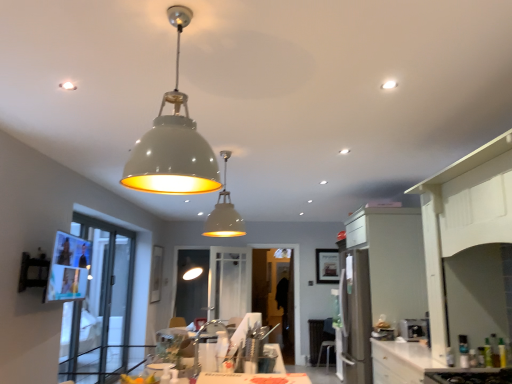
Image resolution: width=512 pixels, height=384 pixels. What do you see at coordinates (408, 363) in the screenshot?
I see `white glossy countertop at lower right` at bounding box center [408, 363].

Measure the distance between white glossy countertop at lower right and camera.

white glossy countertop at lower right is 2.74 meters from camera.

Locate an element on the screen. transparent glass door at center, the 1th glass door viewed from the right is located at coordinates (275, 286).

This screenshot has width=512, height=384. What do you see at coordinates (224, 212) in the screenshot?
I see `matte white pendant light at center, which appears as the second lamp when viewed from the front` at bounding box center [224, 212].

The height and width of the screenshot is (384, 512). Identify the location of matte white dome at center, the second lamp when ordered from back to front. (173, 143).

This screenshot has height=384, width=512. Describe the element at coordinates (414, 329) in the screenshot. I see `satin silver toaster at lower right, positioned as the first appliance in right-to-left order` at that location.

Image resolution: width=512 pixels, height=384 pixels. Describe the element at coordinates (327, 343) in the screenshot. I see `matte white chair at lower center` at that location.

You are a GUI agent. You are given a task and a screenshot of the screen. Output one action in this format:
    pyautogui.click(x=<x>, y=<y>)
    Task: Click on the white glossy countertop at lower right
    The width and height of the screenshot is (512, 384).
    Given the screenshot: What is the action you would take?
    pyautogui.click(x=408, y=363)

Does point (373, 229) lie in front of point (469, 334)?

That is False.

Is satin white cabinet at right directly adjacent to white glossy cabinet at right?

No, satin white cabinet at right is not with white glossy cabinet at right.

Who is taller, satin white cabinet at right or white glossy cabinet at right?

With more height is satin white cabinet at right.

Between satin white cabinet at right and white glossy cabinet at right, which one appears on the left side from the viewer's perspective?

Positioned to the left is satin white cabinet at right.

Is matte white pendant light at center, which ranks as the 1th lamp in back-to-front order, to the left of satin silver toaster at lower right, the 2th appliance when ordered from right to left, from the viewer's perspective?

Yes, matte white pendant light at center, which ranks as the 1th lamp in back-to-front order, is to the left of satin silver toaster at lower right, the 2th appliance when ordered from right to left.

Considering the sizes of objects matte white pendant light at center, which appears as the second lamp when viewed from the front, and satin silver toaster at lower right, placed as the 1th appliance when sorted from left to right, in the image provided, who is shorter, matte white pendant light at center, which appears as the second lamp when viewed from the front, or satin silver toaster at lower right, placed as the 1th appliance when sorted from left to right,?

satin silver toaster at lower right, placed as the 1th appliance when sorted from left to right, is shorter.

From the image's perspective, relative to satin silver toaster at lower right, the 2th appliance when ordered from right to left, is matte white pendant light at center, which ranks as the 1th lamp in back-to-front order, above or below?

Clearly, from the image's perspective, matte white pendant light at center, which ranks as the 1th lamp in back-to-front order, is above satin silver toaster at lower right, the 2th appliance when ordered from right to left.

Measure the distance from matte white pendant light at center, which appears as the second lamp when viewed from the front, to satin silver toaster at lower right, placed as the 1th appliance when sorted from left to right.

1.78 meters.

Is matte white dome at center, which is the 1th lamp from front to back, to the right of satin white cabinet at right from the viewer's perspective?

No, matte white dome at center, which is the 1th lamp from front to back, is not to the right of satin white cabinet at right.

Is matte white dome at center, the second lamp when ordered from back to front, bigger or smaller than satin white cabinet at right?

matte white dome at center, the second lamp when ordered from back to front, is smaller than satin white cabinet at right.

From a real-world perspective, starting from the satin white cabinet at right, which lamp is the 2nd one vertically above it? Please provide its 2D coordinates.

[(173, 143)]

Measure the distance between matte white dome at center, which is the 1th lamp from front to back, and satin white cabinet at right.

matte white dome at center, which is the 1th lamp from front to back, and satin white cabinet at right are 3.10 meters apart.

Can you tell me how much transparent glass door at left, which is the second glass door from back to front, and satin silver toaster at lower right, the 2th appliance when ordered from right to left, differ in facing direction?

There is a 180-degree angle between the facing directions of transparent glass door at left, which is the second glass door from back to front, and satin silver toaster at lower right, the 2th appliance when ordered from right to left.

From a real-world perspective, who is located higher, transparent glass door at left, which is the second glass door from back to front, or satin silver toaster at lower right, the 2th appliance when ordered from right to left?

From a 3D spatial view, transparent glass door at left, which is the second glass door from back to front, is above.

From the image's perspective, is transparent glass door at left, which is counted as the 1th glass door, starting from the front, over satin silver toaster at lower right, the 2th appliance when ordered from right to left?

Incorrect, from the image's perspective, transparent glass door at left, which is counted as the 1th glass door, starting from the front, is lower than satin silver toaster at lower right, the 2th appliance when ordered from right to left.

Is the position of transparent glass door at left, which appears as the 1th glass door when viewed from the left, less distant than that of satin silver toaster at lower right, placed as the 1th appliance when sorted from left to right?

Yes, transparent glass door at left, which appears as the 1th glass door when viewed from the left, is in front of satin silver toaster at lower right, placed as the 1th appliance when sorted from left to right.

Looking at this image, which of these two, transparent glass door at left, which appears as the 1th glass door when viewed from the left, or matte white dome at center, which is the 1th lamp from front to back, is bigger?

With larger size is transparent glass door at left, which appears as the 1th glass door when viewed from the left.

Considering the relative positions of transparent glass door at left, which is counted as the 1th glass door, starting from the front, and matte white dome at center, which is the 1th lamp from front to back, in the image provided, is transparent glass door at left, which is counted as the 1th glass door, starting from the front, to the left or to the right of matte white dome at center, which is the 1th lamp from front to back,?

In the image, transparent glass door at left, which is counted as the 1th glass door, starting from the front, appears on the left side of matte white dome at center, which is the 1th lamp from front to back.

Is transparent glass door at left, which is the second glass door from back to front, facing towards matte white dome at center, which is the 1th lamp from front to back?

No, transparent glass door at left, which is the second glass door from back to front, is not facing towards matte white dome at center, which is the 1th lamp from front to back.

What's the angular difference between transparent glass door at left, which is the second glass door from back to front, and matte white dome at center, the second lamp when ordered from back to front,'s facing directions?

93 degrees.

From the image's perspective, is white glossy cabinet at right located above transparent glass door at left, which appears as the 1th glass door when viewed from the left?

Yes.

Does white glossy cabinet at right have a greater height compared to transparent glass door at left, which is the second glass door from back to front?

No.

Considering the relative positions of white glossy cabinet at right and transparent glass door at left, arranged as the 2th glass door when viewed from the right, in the image provided, is white glossy cabinet at right behind transparent glass door at left, arranged as the 2th glass door when viewed from the right,?

That is False.

Can you tell me how much white glossy cabinet at right and transparent glass door at left, which is the second glass door from back to front, differ in facing direction?

180 degrees.

Considering the relative sizes of satin white cabinet at right and satin silver toaster at lower right, positioned as the first appliance in right-to-left order, in the image provided, is satin white cabinet at right smaller than satin silver toaster at lower right, positioned as the first appliance in right-to-left order,?

No.

Is satin white cabinet at right further to camera compared to satin silver toaster at lower right, positioned as the first appliance in right-to-left order?

Yes, satin white cabinet at right is further from the camera.

Is point (400, 248) positioned behind point (411, 319)?

Yes, point (400, 248) is behind point (411, 319).

In order to click on side on the right of the satin white cabinet at right in this screenshot , I will do `click(469, 249)`.

This screenshot has height=384, width=512. I want to click on the 1st lamp to the left of the satin silver toaster at lower right, placed as the 1th appliance when sorted from left to right, counting from the anchor's position, so click(x=224, y=212).

Considering their positions, is transparent glass door at center, which ranks as the second glass door in left-to-right order, positioned closer to satin white cabinet at right than satin silver toaster at lower right, positioned as the first appliance in right-to-left order?

satin silver toaster at lower right, positioned as the first appliance in right-to-left order, lies closer to satin white cabinet at right than the other object.

When comparing their distances from satin silver toaster at lower right, placed as the 1th appliance when sorted from left to right, does matte white chair at lower center or transparent glass door at center, which is the 2th glass door from front to back, seem further?

Based on the image, transparent glass door at center, which is the 2th glass door from front to back, appears to be further to satin silver toaster at lower right, placed as the 1th appliance when sorted from left to right.

Based on their spatial positions, is satin silver toaster at lower right, which ranks as the second appliance in left-to-right order, or white glossy cabinet at right closer to transparent glass door at center, the 1th glass door viewed from the right?

Based on the image, satin silver toaster at lower right, which ranks as the second appliance in left-to-right order, appears to be nearer to transparent glass door at center, the 1th glass door viewed from the right.

When comparing their distances from matte white chair at lower center, does satin white cabinet at right or matte white dome at center, which is the 1th lamp from front to back, seem further?

The object further to matte white chair at lower center is matte white dome at center, which is the 1th lamp from front to back.

From the image, which object appears to be nearer to satin silver toaster at lower right, the 2th appliance when ordered from right to left, transparent glass door at left, which is counted as the 1th glass door, starting from the front, or satin silver toaster at lower right, which ranks as the second appliance in left-to-right order?

satin silver toaster at lower right, which ranks as the second appliance in left-to-right order, lies closer to satin silver toaster at lower right, the 2th appliance when ordered from right to left, than the other object.

Considering their positions, is matte white pendant light at center, which appears as the second lamp when viewed from the front, positioned closer to transparent glass door at left, arranged as the 2th glass door when viewed from the right, than matte white chair at lower center?

matte white pendant light at center, which appears as the second lamp when viewed from the front, is closer to transparent glass door at left, arranged as the 2th glass door when viewed from the right.

Which object lies nearer to the anchor point transparent glass door at center, the 1th glass door viewed from the right, satin silver toaster at lower right, positioned as the first appliance in right-to-left order, or matte white dome at center, which is the 1th lamp from front to back?

satin silver toaster at lower right, positioned as the first appliance in right-to-left order, is closer to transparent glass door at center, the 1th glass door viewed from the right.

Which object lies further to the anchor point matte white dome at center, which is the 1th lamp from front to back, satin silver toaster at lower right, the 2th appliance when ordered from right to left, or satin white cabinet at right?

satin silver toaster at lower right, the 2th appliance when ordered from right to left, is further to matte white dome at center, which is the 1th lamp from front to back.

The image size is (512, 384). I want to click on counter top located between matte white dome at center, the second lamp when ordered from back to front, and matte white chair at lower center in the depth direction, so click(x=408, y=363).

Identify the location of glass door located between white glossy cabinet at right and transparent glass door at center, which ranks as the second glass door in left-to-right order, in the depth direction. (100, 306).

You are a GUI agent. You are given a task and a screenshot of the screen. Output one action in this format:
    pyautogui.click(x=<x>, y=<y>)
    Task: Click on the cabinetry between white glossy countertop at lower right and transparent glass door at center, which is the 2th glass door from front to back, in the front-back direction
    The height and width of the screenshot is (384, 512).
    Given the screenshot: What is the action you would take?
    pyautogui.click(x=392, y=260)

Find the location of a particular element. cabinetry between satin silver toaster at lower right, positioned as the first appliance in right-to-left order, and matte white chair at lower center in the front-back direction is located at coordinates (392, 260).